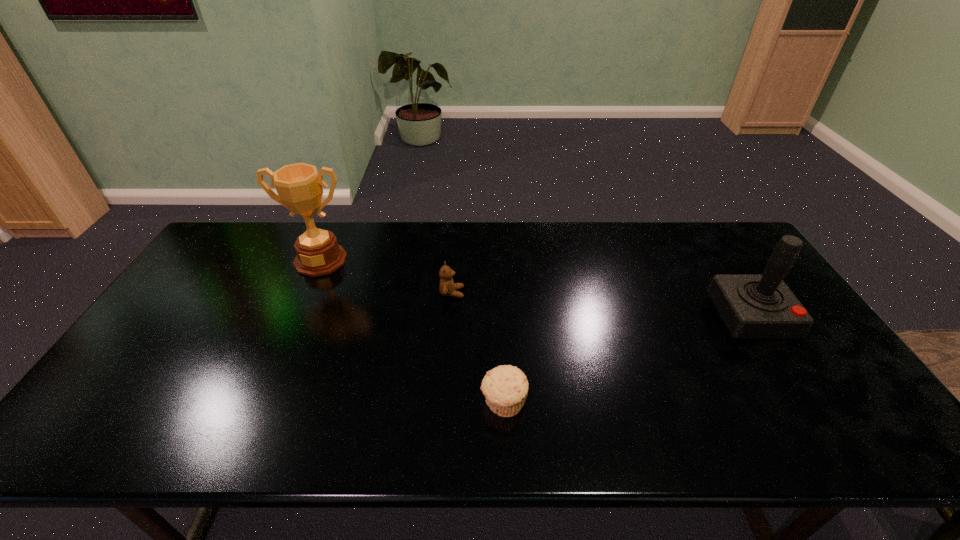
This screenshot has width=960, height=540. Find the location of `vacant point at the far right corner`. vacant point at the far right corner is located at coordinates (713, 244).

What are the coordinates of `unoccupied position between the second object from left to right and the award` in the screenshot? It's located at (386, 276).

Where is `free space that is in between the third object from left to right and the leftmost object`? free space that is in between the third object from left to right and the leftmost object is located at coordinates (412, 332).

At what (x,y) coordinates should I click in order to perform the action: click on free spot between the rightmost object and the award. Please return your answer as a coordinate pair (x, y). Looking at the image, I should click on (536, 288).

Identify the location of free space between the tallest object and the third object from right to left. (386, 276).

The height and width of the screenshot is (540, 960). In order to click on empty location between the third shortest object and the nearest object in this screenshot , I will do `click(627, 360)`.

This screenshot has height=540, width=960. I want to click on free space between the joystick and the tallest object, so click(x=536, y=288).

The image size is (960, 540). Identify the location of free space between the rightmost object and the farthest object. (536, 288).

Locate an element on the screen. blank region between the joystick and the teddy bear is located at coordinates (601, 305).

Image resolution: width=960 pixels, height=540 pixels. I want to click on vacant space in between the teddy bear and the second tallest object, so click(x=601, y=305).